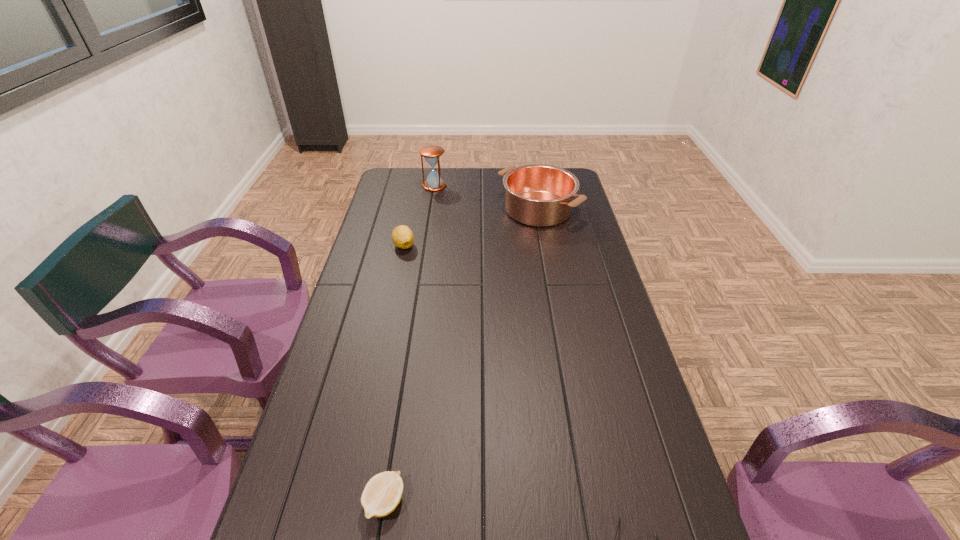
At what (x,y) coordinates should I click in order to perform the action: click on empty space that is in between the hourglass and the shorter lemon. Please return your answer as a coordinate pair (x, y). The image size is (960, 540). Looking at the image, I should click on (410, 344).

The height and width of the screenshot is (540, 960). What are the coordinates of `vacant region between the shorter lemon and the second tallest object` in the screenshot? It's located at (462, 355).

Where is `vacant space that's between the farther lemon and the second tallest object`? vacant space that's between the farther lemon and the second tallest object is located at coordinates (471, 227).

Locate an element on the screen. vacant region between the shorter lemon and the tallest object is located at coordinates 410,344.

Where is `free area in between the tallest object and the shorter lemon`? The height and width of the screenshot is (540, 960). free area in between the tallest object and the shorter lemon is located at coordinates (410, 344).

Locate an element on the screen. Image resolution: width=960 pixels, height=540 pixels. the third closest object to the saucepan is located at coordinates (382, 494).

Find the location of a particular element. the second closest object relative to the hourglass is located at coordinates (402, 236).